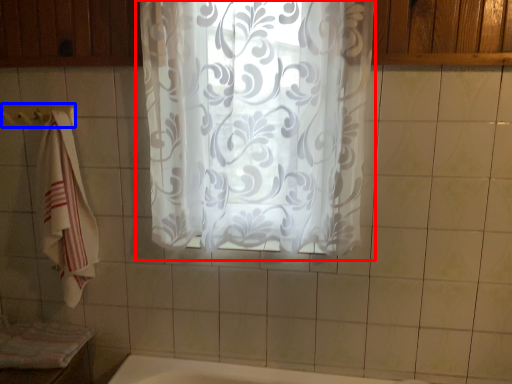
Question: Which object appears farthest to the camera in this image, curtain (highlighted by a red box) or towel bar (highlighted by a blue box)?

Choices:
 (A) curtain
 (B) towel bar

Answer: (B)